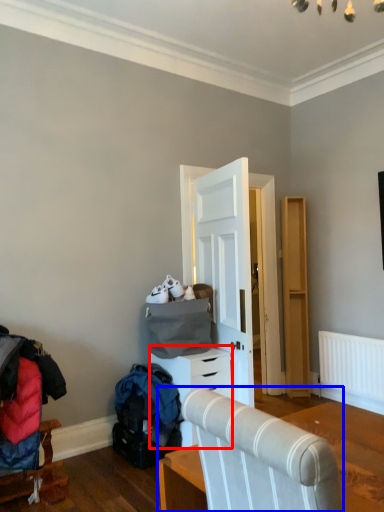
Question: Among these objects, which one is nearest to the camera, chest of drawers (highlighted by a red box) or furniture (highlighted by a blue box)?

Choices:
 (A) chest of drawers
 (B) furniture

Answer: (B)